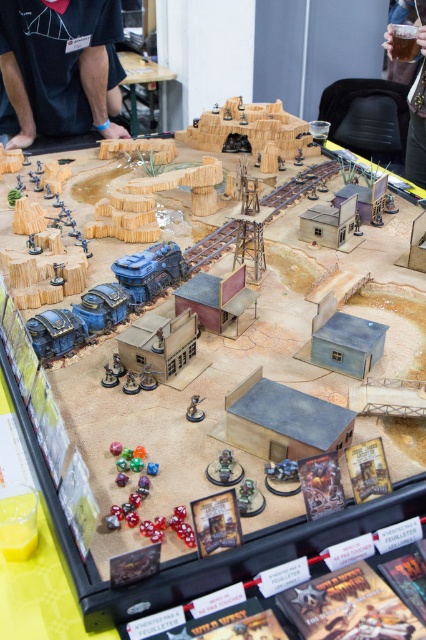
You are a GUI agent. You are given a task and a screenshot of the screen. Output one action in this format:
    pyautogui.click(x=<x>, y=<y>)
    Task: Click on the black fabric at upper left
    The image size is (426, 640).
    Given the screenshot: What is the action you would take?
    pyautogui.click(x=58, y=67)

How distant is black fabric at upper left from wooden table at upper center?

They are 4.69 feet apart.

Where is `black fabric at upper left`? black fabric at upper left is located at coordinates (58, 67).

Which is below, translucent plastic cup at upper right or metallic silver figure at center?

metallic silver figure at center is lower down.

Is translucent plastic cup at upper right positioned in front of metallic silver figure at center?

No, translucent plastic cup at upper right is behind metallic silver figure at center.

What do you see at coordinates (417, 109) in the screenshot?
I see `translucent plastic cup at upper right` at bounding box center [417, 109].

The width and height of the screenshot is (426, 640). In order to click on translucent plastic cup at upper right in this screenshot , I will do `click(417, 109)`.

Is black fabric at upper left shorter than metallic silver figure at center?

In fact, black fabric at upper left may be taller than metallic silver figure at center.

Does point (22, 128) lie behind point (193, 403)?

Yes, it is behind point (193, 403).

Is point (91, 122) farther from camera compared to point (189, 413)?

That is True.

This screenshot has height=640, width=426. Identify the location of black fabric at upper left. (58, 67).